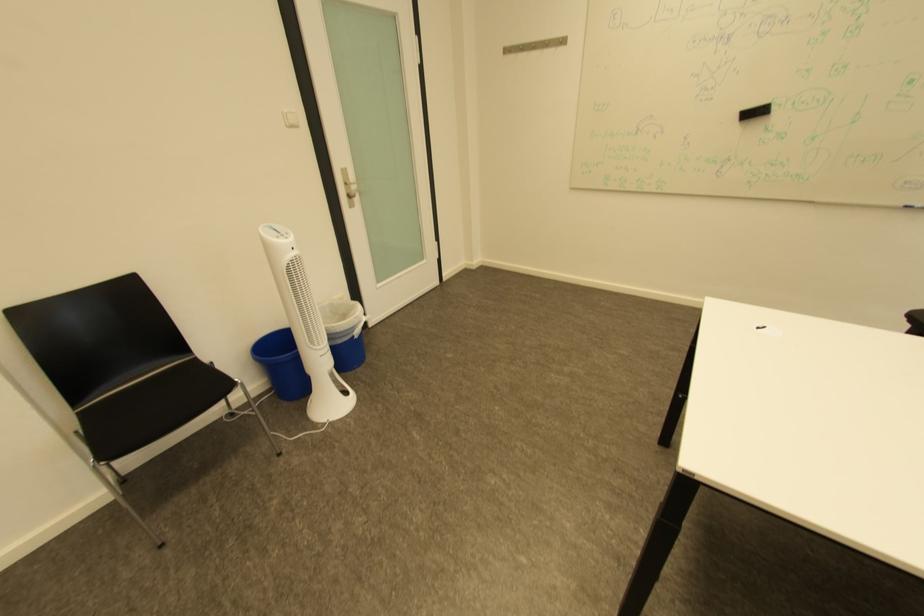
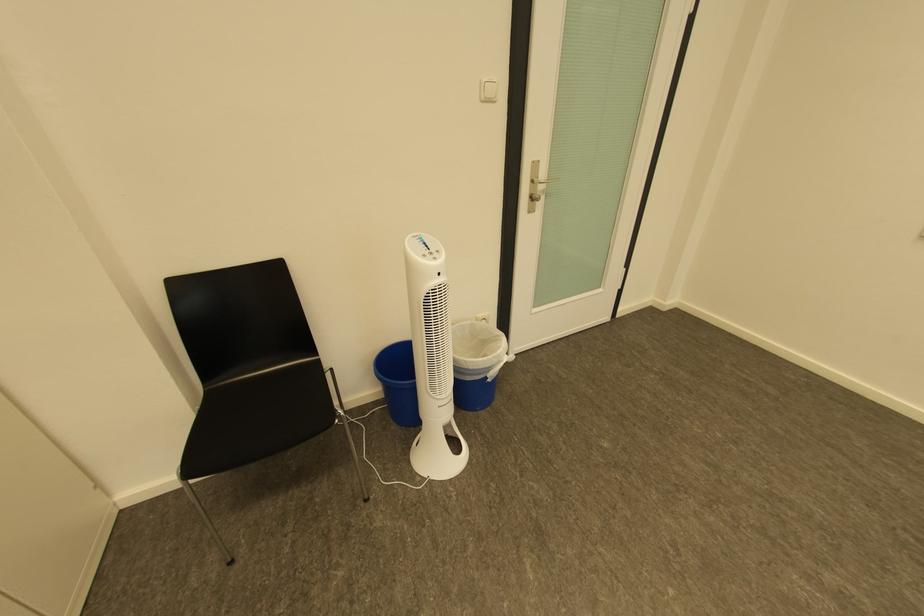
Locate, in the second image, the point that corresponds to point (355, 185) in the first image.

(541, 182)